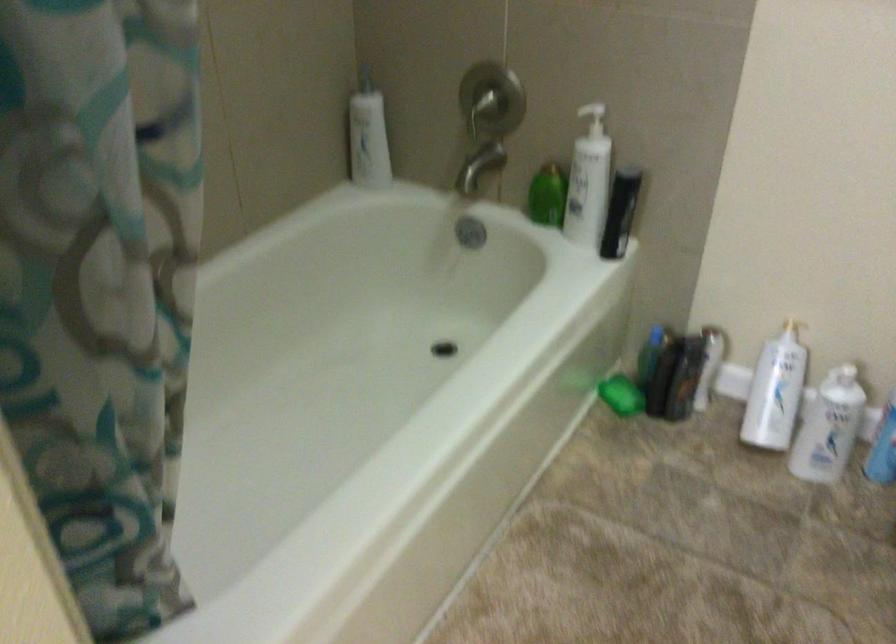
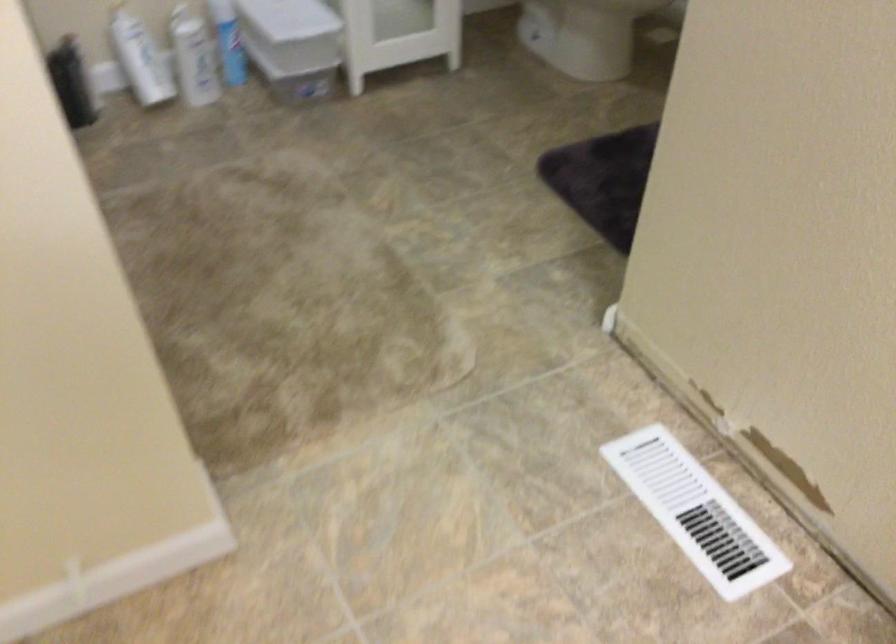
Locate, in the second image, the point that corresponds to point (754, 389) in the first image.

(140, 59)